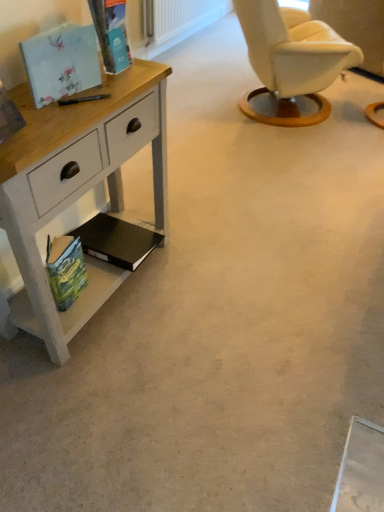
Question: Is the position of green matte book at lower left, acting as the 4th magazine starting from the top, less distant than that of black matte book at lower left, arranged as the third magazine when viewed from the top?

Choices:
 (A) no
 (B) yes

Answer: (B)

Question: From the image's perspective, is green matte book at lower left, acting as the 4th magazine starting from the top, over black matte book at lower left, the 2th magazine from the bottom?

Choices:
 (A) no
 (B) yes

Answer: (A)

Question: Is black matte book at lower left, the 2th magazine from the bottom, a part of green matte book at lower left, the first magazine from the bottom?

Choices:
 (A) yes
 (B) no

Answer: (B)

Question: Is green matte book at lower left, the first magazine from the bottom, positioned with its back to black matte book at lower left, arranged as the third magazine when viewed from the top?

Choices:
 (A) no
 (B) yes

Answer: (A)

Question: Can you confirm if green matte book at lower left, the first magazine from the bottom, is bigger than black matte book at lower left, arranged as the third magazine when viewed from the top?

Choices:
 (A) no
 (B) yes

Answer: (A)

Question: From the image's perspective, is green matte book at lower left, acting as the 4th magazine starting from the top, beneath black matte book at lower left, the 2th magazine from the bottom?

Choices:
 (A) yes
 (B) no

Answer: (A)

Question: Is black matte book at lower left, the 2th magazine from the bottom, oriented away from green matte book at lower left, acting as the 4th magazine starting from the top?

Choices:
 (A) no
 (B) yes

Answer: (A)

Question: Can you confirm if black matte book at lower left, the 2th magazine from the bottom, is wider than green matte book at lower left, acting as the 4th magazine starting from the top?

Choices:
 (A) no
 (B) yes

Answer: (B)

Question: Does black matte book at lower left, arranged as the third magazine when viewed from the top, have a smaller size compared to green matte book at lower left, the first magazine from the bottom?

Choices:
 (A) no
 (B) yes

Answer: (A)

Question: Does black matte book at lower left, the 2th magazine from the bottom, come in front of green matte book at lower left, acting as the 4th magazine starting from the top?

Choices:
 (A) no
 (B) yes

Answer: (A)

Question: Does black matte book at lower left, the 2th magazine from the bottom, appear on the left side of green matte book at lower left, the first magazine from the bottom?

Choices:
 (A) no
 (B) yes

Answer: (A)

Question: Considering the relative sizes of black matte book at lower left, the 2th magazine from the bottom, and green matte book at lower left, acting as the 4th magazine starting from the top, in the image provided, is black matte book at lower left, the 2th magazine from the bottom, thinner than green matte book at lower left, acting as the 4th magazine starting from the top,?

Choices:
 (A) no
 (B) yes

Answer: (A)

Question: From a real-world perspective, is black matte book at lower left, arranged as the third magazine when viewed from the top, located beneath matte floral-patterned book at upper left, which appears as the 3th magazine when ordered from the bottom?

Choices:
 (A) yes
 (B) no

Answer: (A)